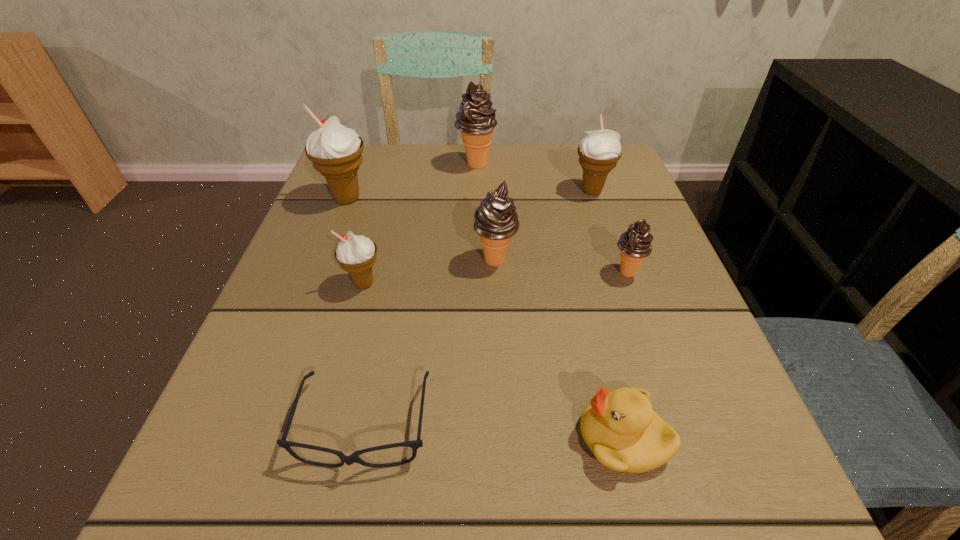
I want to click on vacant space at the far left corner, so click(370, 156).

You are a GUI agent. You are given a task and a screenshot of the screen. Output one action in this format:
    pyautogui.click(x=<x>, y=<y>)
    Task: Click on the vacant space at the near left corner of the desktop
    The image size is (960, 540).
    Given the screenshot: What is the action you would take?
    pyautogui.click(x=207, y=492)

This screenshot has height=540, width=960. In the image, there is a desktop. Find the location of `free region at the far right corner`. free region at the far right corner is located at coordinates (583, 195).

At what (x,y) coordinates should I click in order to perform the action: click on vacant region between the spectacles and the second smallest white icecream. Please return your answer as a coordinate pair (x, y). The width and height of the screenshot is (960, 540). Looking at the image, I should click on (478, 308).

Image resolution: width=960 pixels, height=540 pixels. Identify the location of vacant point located between the second biggest white icecream and the second smallest chocolate icecream. (543, 226).

Identify the location of empty space between the second biggest chocolate icecream and the biggest white icecream. (421, 230).

Locate an element on the screen. Image resolution: width=960 pixels, height=540 pixels. vacant region between the shortest object and the second smallest chocolate icecream is located at coordinates (430, 343).

What are the coordinates of `vacant space that is in between the biggest white icecream and the second smallest white icecream` in the screenshot? It's located at (469, 194).

The width and height of the screenshot is (960, 540). In order to click on vacant region between the shortest object and the rightmost chocolate icecream in this screenshot , I will do `click(495, 349)`.

The height and width of the screenshot is (540, 960). Find the location of `vacant area that lies between the second smallest chocolate icecream and the duckling`. vacant area that lies between the second smallest chocolate icecream and the duckling is located at coordinates (560, 349).